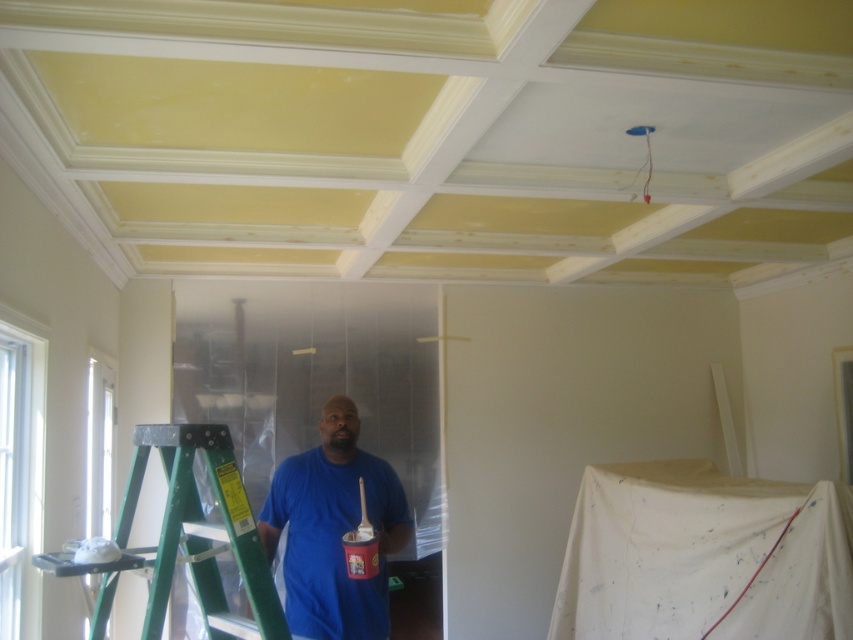
Question: Does blue cotton shirt at center have a smaller size compared to green metallic ladder at center?

Choices:
 (A) yes
 (B) no

Answer: (B)

Question: Which point is closer to the camera?

Choices:
 (A) (228, 522)
 (B) (265, 529)

Answer: (A)

Question: Which point is closer to the camera taking this photo?

Choices:
 (A) (288, 540)
 (B) (157, 602)

Answer: (B)

Question: Is blue cotton shirt at center positioned before green metallic ladder at center?

Choices:
 (A) yes
 (B) no

Answer: (B)

Question: From the image, what is the correct spatial relationship of blue cotton shirt at center in relation to green metallic ladder at center?

Choices:
 (A) right
 (B) left

Answer: (A)